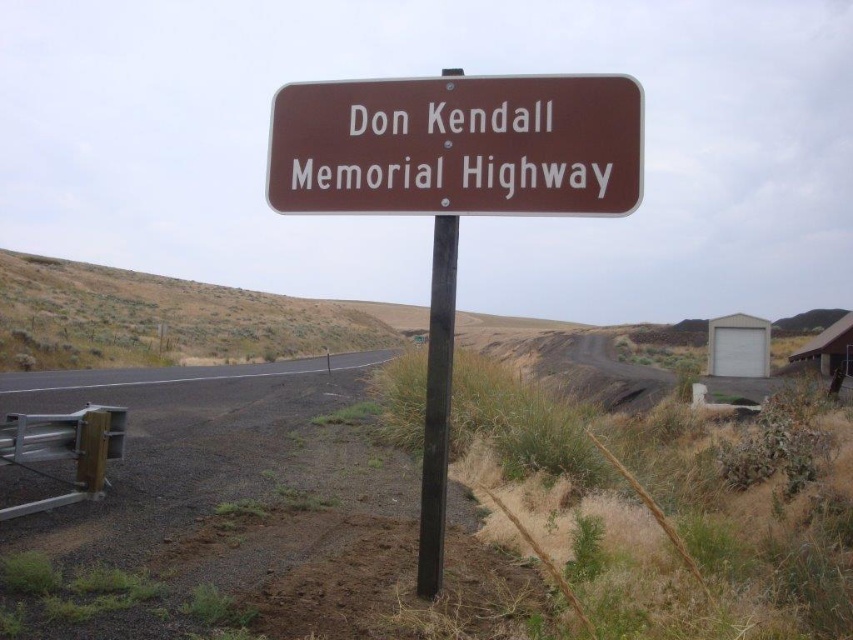
Question: Where is brown metallic sign at center located in relation to black metal pole at center in the image?

Choices:
 (A) right
 (B) left

Answer: (A)

Question: Which point is closer to the camera?

Choices:
 (A) brown metallic sign at center
 (B) black metal pole at center

Answer: (A)

Question: Can you confirm if brown metallic sign at center is positioned to the left of black metal pole at center?

Choices:
 (A) no
 (B) yes

Answer: (A)

Question: Which point is closer to the camera?

Choices:
 (A) (550, 150)
 (B) (432, 371)

Answer: (A)

Question: Does brown metallic sign at center lie behind black metal pole at center?

Choices:
 (A) yes
 (B) no

Answer: (B)

Question: Which of the following is the closest to the observer?

Choices:
 (A) (433, 378)
 (B) (589, 150)

Answer: (B)